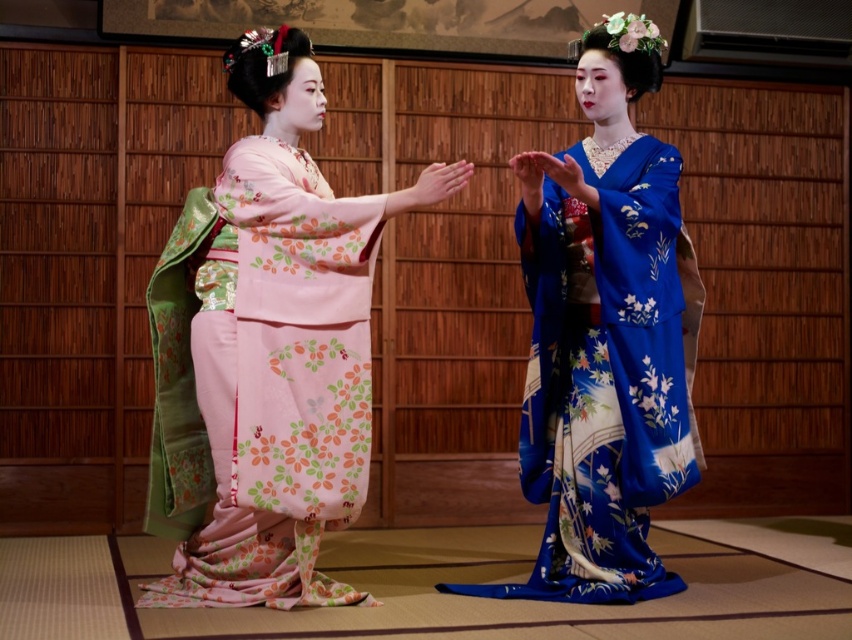
Is pink floral kimono at center thinner than blue silk kimono at center?

No.

Which of these two, pink floral kimono at center or blue silk kimono at center, stands taller?

Standing taller between the two is pink floral kimono at center.

The height and width of the screenshot is (640, 852). Identify the location of pink floral kimono at center. (272, 346).